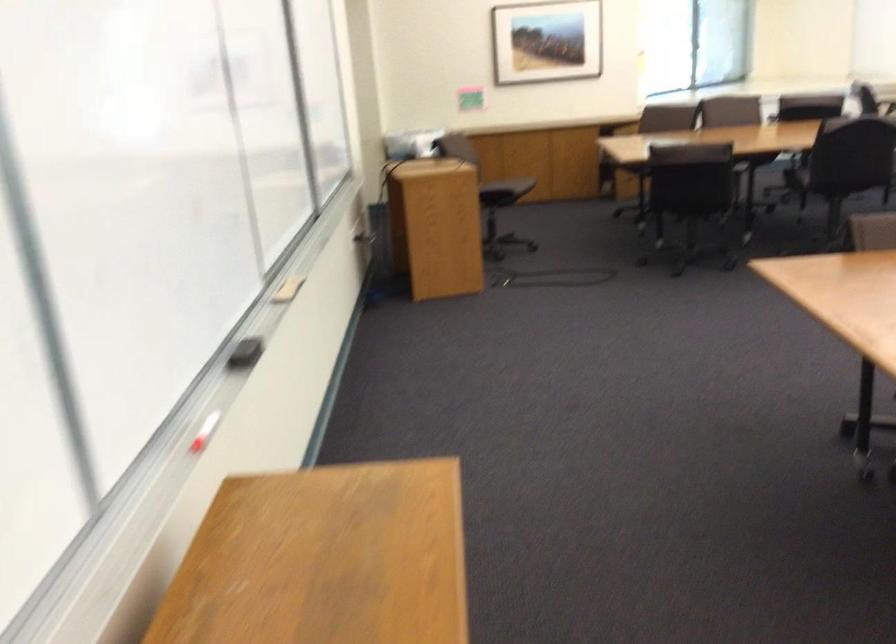
Find where to lift the red whiteboard marker. Please return your answer as a coordinate pair (x, y).

(205, 431)